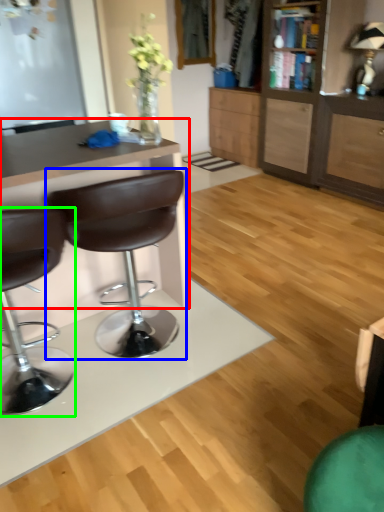
Question: Based on their relative distances, which object is farther from desk (highlighted by a red box)? Choose from chair (highlighted by a blue box) and chair (highlighted by a green box).

Choices:
 (A) chair
 (B) chair

Answer: (B)